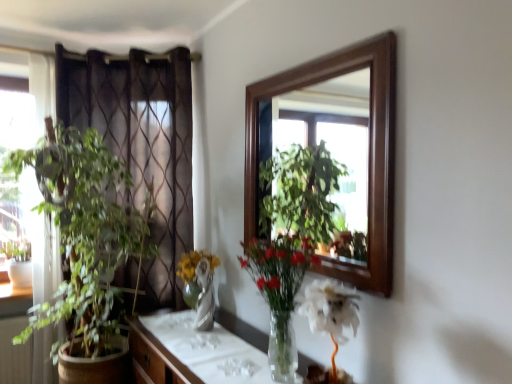
Question: Is translucent glass vase at center, the second houseplant in the back-to-front sequence, at the right side of wooden cabinet at center?

Choices:
 (A) no
 (B) yes

Answer: (B)

Question: From a real-world perspective, is translucent glass vase at center, the second houseplant in the back-to-front sequence, physically above wooden cabinet at center?

Choices:
 (A) yes
 (B) no

Answer: (A)

Question: From the image's perspective, is translucent glass vase at center, marked as the 1th houseplant in a right-to-left arrangement, below wooden cabinet at center?

Choices:
 (A) yes
 (B) no

Answer: (B)

Question: Is translucent glass vase at center, marked as the 1th houseplant in a right-to-left arrangement, touching wooden cabinet at center?

Choices:
 (A) no
 (B) yes

Answer: (A)

Question: Can you confirm if translucent glass vase at center, marked as the 1th houseplant in a right-to-left arrangement, is positioned to the left of wooden cabinet at center?

Choices:
 (A) no
 (B) yes

Answer: (A)

Question: Relative to green leafy plant at left, the first houseplant when ordered from back to front, is wooden cabinet at center in front or behind?

Choices:
 (A) behind
 (B) front

Answer: (B)

Question: Looking at their shapes, would you say wooden cabinet at center is wider or thinner than green leafy plant at left, which is the 2th houseplant in front-to-back order?

Choices:
 (A) thin
 (B) wide

Answer: (B)

Question: In terms of size, does wooden cabinet at center appear bigger or smaller than green leafy plant at left, acting as the 1th houseplant starting from the left?

Choices:
 (A) big
 (B) small

Answer: (B)

Question: In terms of height, does wooden cabinet at center look taller or shorter compared to green leafy plant at left, the first houseplant when ordered from back to front?

Choices:
 (A) tall
 (B) short

Answer: (B)

Question: From a real-world perspective, is translucent glass vase at center, marked as the 1th houseplant in a right-to-left arrangement, above or below wooden cabinet at center?

Choices:
 (A) below
 (B) above

Answer: (B)

Question: From their relative heights in the image, would you say translucent glass vase at center, the second houseplant in the back-to-front sequence, is taller or shorter than wooden cabinet at center?

Choices:
 (A) tall
 (B) short

Answer: (B)

Question: Considering the positions of translucent glass vase at center, marked as the 1th houseplant in a right-to-left arrangement, and wooden cabinet at center in the image, is translucent glass vase at center, marked as the 1th houseplant in a right-to-left arrangement, wider or thinner than wooden cabinet at center?

Choices:
 (A) thin
 (B) wide

Answer: (A)

Question: Is translucent glass vase at center, positioned as the first houseplant in front-to-back order, spatially inside wooden cabinet at center, or outside of it?

Choices:
 (A) inside
 (B) outside

Answer: (B)

Question: From the image's perspective, is brown sheer curtain at left located above or below green leafy plant at left, the first houseplant when ordered from back to front?

Choices:
 (A) below
 (B) above

Answer: (B)

Question: Considering their positions, is brown sheer curtain at left located in front of or behind green leafy plant at left, the second houseplant when ordered from right to left?

Choices:
 (A) front
 (B) behind

Answer: (B)